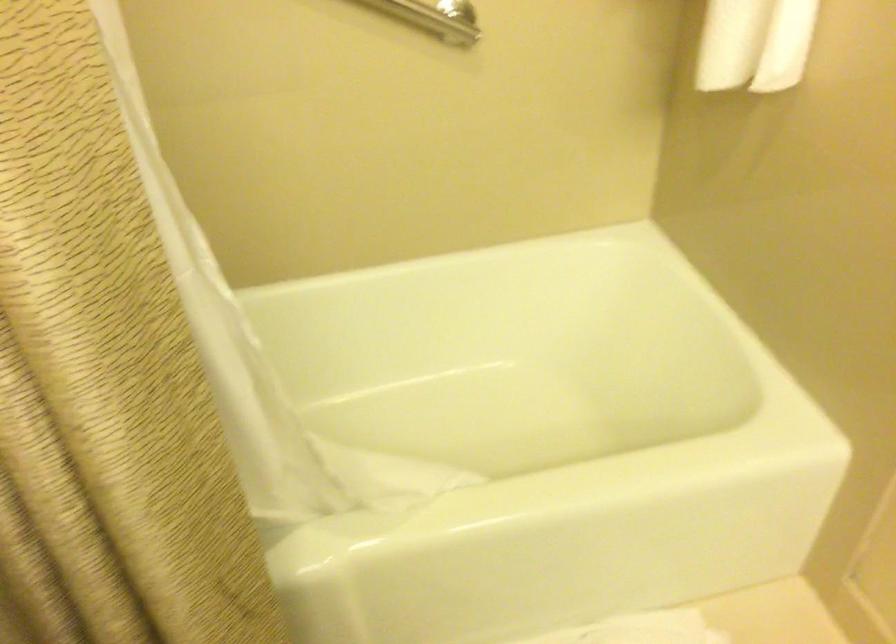
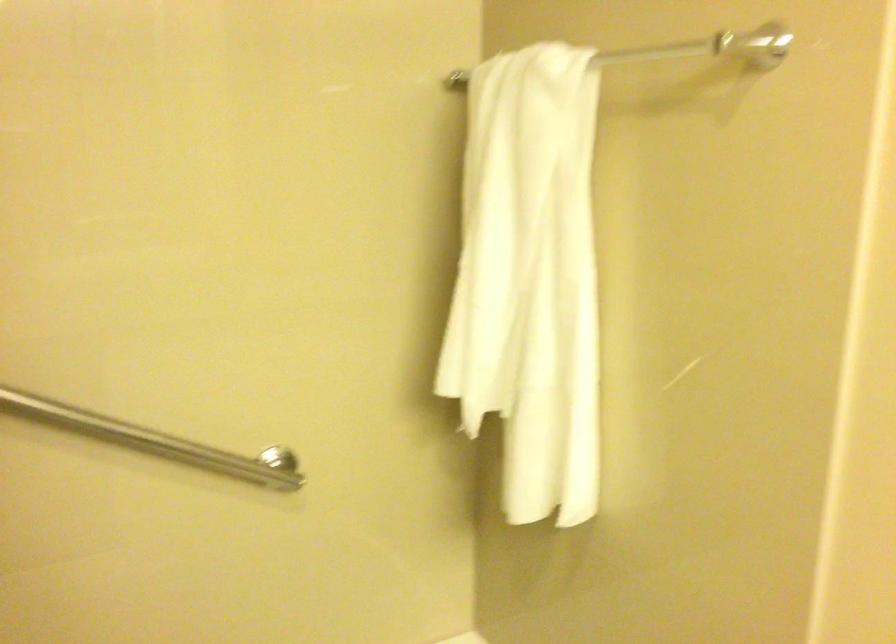
How did the camera likely rotate?

The rotation direction of the camera is right-up.